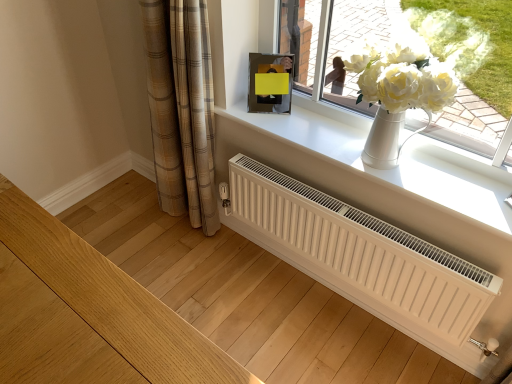
At what (x,y) coordinates should I click in order to perform the action: click on white matte radiator at center. Please return your answer as a coordinate pair (x, y). This screenshot has width=512, height=384. Looking at the image, I should click on (362, 254).

Identify the location of white smooth window sill at upper center. (383, 170).

Can you confirm if plaid fabric curtain at lower left is wider than white ceramic vase at upper center?

Correct, the width of plaid fabric curtain at lower left exceeds that of white ceramic vase at upper center.

From the image's perspective, who appears lower, plaid fabric curtain at lower left or white ceramic vase at upper center?

plaid fabric curtain at lower left is shown below in the image.

Considering the sizes of plaid fabric curtain at lower left and white ceramic vase at upper center in the image, is plaid fabric curtain at lower left bigger or smaller than white ceramic vase at upper center?

plaid fabric curtain at lower left is bigger than white ceramic vase at upper center.

Would you say white smooth window sill at upper center is part of plaid fabric curtain at lower left's contents?

No, white smooth window sill at upper center is located outside of plaid fabric curtain at lower left.

Is plaid fabric curtain at lower left turned away from white smooth window sill at upper center?

plaid fabric curtain at lower left does not have its back to white smooth window sill at upper center.

Consider the image. Which of these two, plaid fabric curtain at lower left or white smooth window sill at upper center, is thinner?

plaid fabric curtain at lower left.

Considering the relative sizes of metallic reflective picture frame at upper center and white smooth window sill at upper center in the image provided, is metallic reflective picture frame at upper center taller than white smooth window sill at upper center?

Indeed, metallic reflective picture frame at upper center has a greater height compared to white smooth window sill at upper center.

Between metallic reflective picture frame at upper center and white smooth window sill at upper center, which one appears on the left side from the viewer's perspective?

Positioned to the left is metallic reflective picture frame at upper center.

From a real-world perspective, which is physically above, metallic reflective picture frame at upper center or white smooth window sill at upper center?

From a 3D spatial view, metallic reflective picture frame at upper center is above.

Could you tell me if metallic reflective picture frame at upper center is facing white smooth window sill at upper center?

No, metallic reflective picture frame at upper center is not turned towards white smooth window sill at upper center.

Is white ceramic vase at upper center facing towards white smooth window sill at upper center?

Yes.

Measure the distance between white ceramic vase at upper center and white smooth window sill at upper center.

white ceramic vase at upper center is 10.21 inches from white smooth window sill at upper center.

Which is nearer, (377, 17) or (360, 131)?

The point (377, 17) is in front.

From a real-world perspective, is white ceramic vase at upper center below white smooth window sill at upper center?

No.

Does point (463, 221) appear closer or farther from the camera than point (269, 69)?

Point (463, 221).

Considering the sizes of objects white smooth window sill at upper center and metallic reflective picture frame at upper center in the image provided, who is wider, white smooth window sill at upper center or metallic reflective picture frame at upper center?

white smooth window sill at upper center.

Which is behind, white smooth window sill at upper center or metallic reflective picture frame at upper center?

metallic reflective picture frame at upper center is further away from the camera.

Is white smooth window sill at upper center positioned with its back to metallic reflective picture frame at upper center?

No, white smooth window sill at upper center is not facing away from metallic reflective picture frame at upper center.

Based on the photo, between white smooth window sill at upper center and white ceramic vase at upper center, which one is positioned in front?

Positioned in front is white ceramic vase at upper center.

How different are the orientations of white smooth window sill at upper center and white ceramic vase at upper center in degrees?

white smooth window sill at upper center and white ceramic vase at upper center are facing 0.148 degrees away from each other.

From the image's perspective, relative to white ceramic vase at upper center, is white smooth window sill at upper center above or below?

Based on their image positions, white smooth window sill at upper center is located beneath white ceramic vase at upper center.

Is plaid fabric curtain at lower left not close to white matte radiator at center?

They are positioned close to each other.

From a real-world perspective, which is physically below, plaid fabric curtain at lower left or white matte radiator at center?

In real-world perspective, white matte radiator at center is lower.

Based on their sizes in the image, would you say plaid fabric curtain at lower left is bigger or smaller than white matte radiator at center?

In the image, plaid fabric curtain at lower left appears to be larger than white matte radiator at center.

Find the location of `curtain on the left of white matte radiator at center`. curtain on the left of white matte radiator at center is located at coordinates (181, 108).

The width and height of the screenshot is (512, 384). What are the coordinates of `window lying above the plaid fabric curtain at lower left (from the image's perspective)` in the screenshot? It's located at click(469, 124).

Locate an element on the screen. This screenshot has height=384, width=512. window sill located below the plaid fabric curtain at lower left (from the image's perspective) is located at coordinates (383, 170).

Based on their spatial positions, is white ceramic vase at upper center or white matte radiator at center further from metallic reflective picture frame at upper center?

The object further to metallic reflective picture frame at upper center is white matte radiator at center.

Based on their spatial positions, is metallic reflective picture frame at upper center or white smooth window sill at upper center further from white matte radiator at center?

metallic reflective picture frame at upper center.

When comparing their distances from white ceramic vase at upper center, does white smooth window sill at upper center or metallic reflective picture frame at upper center seem closer?

metallic reflective picture frame at upper center.

Looking at the image, which one is located closer to metallic reflective picture frame at upper center, plaid fabric curtain at lower left or white ceramic vase at upper center?

Based on the image, white ceramic vase at upper center appears to be nearer to metallic reflective picture frame at upper center.

Estimate the real-world distances between objects in this image. Which object is further from white ceramic vase at upper center, white smooth window sill at upper center or white matte radiator at center?

white matte radiator at center is positioned further to the anchor white ceramic vase at upper center.

Which object lies nearer to the anchor point white smooth window sill at upper center, plaid fabric curtain at lower left or white ceramic vase at upper center?

white ceramic vase at upper center lies closer to white smooth window sill at upper center than the other object.

Which object lies further to the anchor point white matte radiator at center, metallic reflective picture frame at upper center or plaid fabric curtain at lower left?

Among the two, metallic reflective picture frame at upper center is located further to white matte radiator at center.

Looking at the image, which one is located closer to white smooth window sill at upper center, white ceramic vase at upper center or plaid fabric curtain at lower left?

The object closer to white smooth window sill at upper center is white ceramic vase at upper center.

Where is `window sill between white ceramic vase at upper center and white matte radiator at center from top to bottom`? Image resolution: width=512 pixels, height=384 pixels. window sill between white ceramic vase at upper center and white matte radiator at center from top to bottom is located at coordinates (383, 170).

Where is `window between metallic reflective picture frame at upper center and white matte radiator at center in the up-down direction`? The height and width of the screenshot is (384, 512). window between metallic reflective picture frame at upper center and white matte radiator at center in the up-down direction is located at coordinates (469, 124).

I want to click on picture frame between plaid fabric curtain at lower left and white smooth window sill at upper center, so click(x=270, y=83).

This screenshot has height=384, width=512. Identify the location of window sill between plaid fabric curtain at lower left and white ceramic vase at upper center. (383, 170).